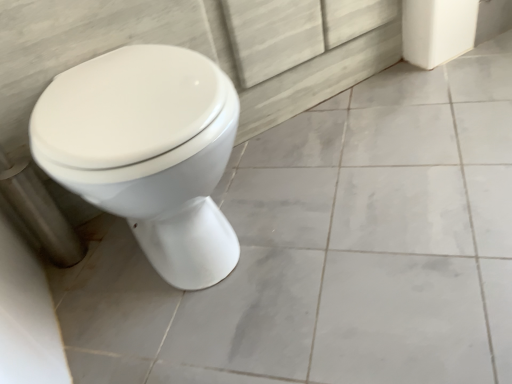
Locate an element on the screen. The height and width of the screenshot is (384, 512). white glossy toilet at left is located at coordinates (147, 151).

This screenshot has height=384, width=512. Describe the element at coordinates (147, 151) in the screenshot. I see `white glossy toilet at left` at that location.

Where is `white glossy toilet at left`? Image resolution: width=512 pixels, height=384 pixels. white glossy toilet at left is located at coordinates (147, 151).